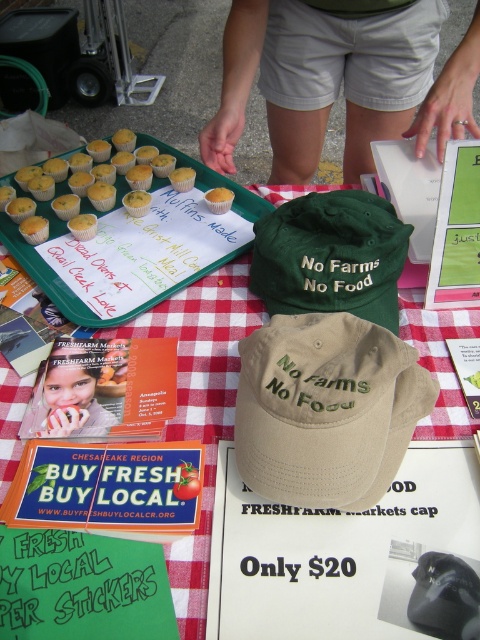
Can you confirm if tan fabric cap at center is wider than red checkered tablecloth at center?

In fact, tan fabric cap at center might be narrower than red checkered tablecloth at center.

Who is shorter, tan fabric cap at center or red checkered tablecloth at center?

Standing shorter between the two is tan fabric cap at center.

Which is in front, point (351, 339) or point (12, 433)?

Point (351, 339)

You are a GUI agent. You are given a task and a screenshot of the screen. Output one action in this format:
    pyautogui.click(x=<x>, y=<y>)
    Task: Click on the tan fabric cap at center
    
    Given the screenshot: What is the action you would take?
    (x=325, y=410)

Looking at this image, is the position of tan fabric cap at center less distant than that of yellow paper muffin at upper left?

Yes, it is in front of yellow paper muffin at upper left.

Between point (354, 480) and point (66, 230), which one is positioned behind?

Positioned behind is point (66, 230).

The height and width of the screenshot is (640, 480). Identify the location of tan fabric cap at center. (325, 410).

Is point (67, 301) behind point (196, 168)?

No, (67, 301) is in front of (196, 168).

Who is more forward, (264,212) or (121,186)?

Point (264,212)

Identify the location of green plastic tray at upper left. (222, 184).